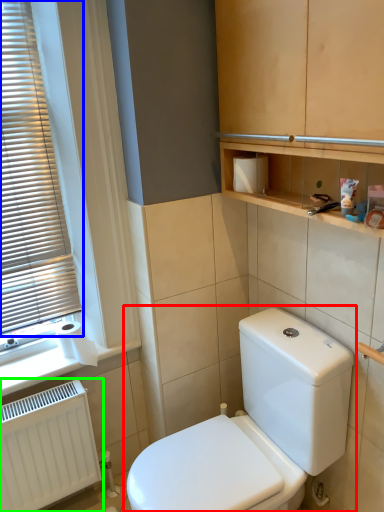
Question: Based on their relative distances, which object is farther from toilet (highlighted by a red box)? Choose from window blind (highlighted by a blue box) and radiator (highlighted by a green box).

Choices:
 (A) window blind
 (B) radiator

Answer: (A)